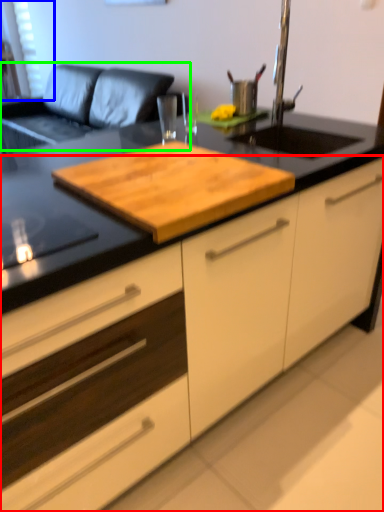
Question: Estimate the real-world distances between objects in this image. Which object is closer to cabinetry (highlighted by a red box), window screen (highlighted by a blue box) or couch (highlighted by a green box)?

Choices:
 (A) window screen
 (B) couch

Answer: (B)